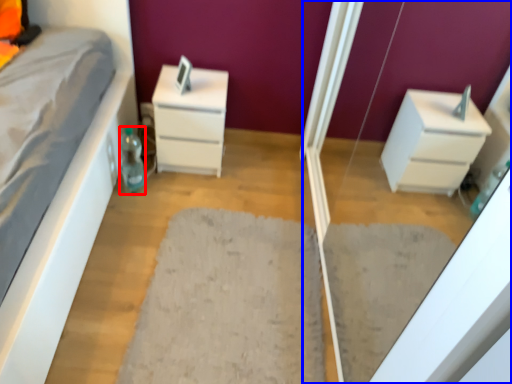
Question: Which point is further to the camera, bottle (highlighted by a red box) or screen door (highlighted by a blue box)?

Choices:
 (A) bottle
 (B) screen door

Answer: (A)